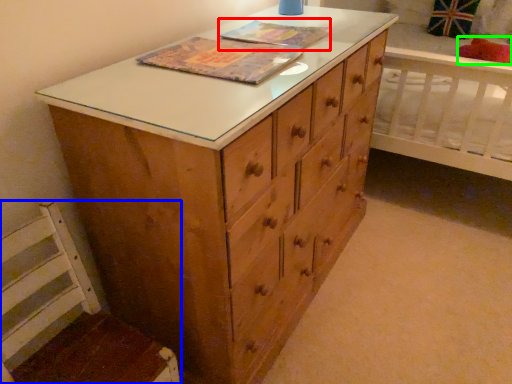
Question: Which is farther away from book cover (highlighted by a red box)? swivel chair (highlighted by a blue box) or pillow (highlighted by a green box)?

Choices:
 (A) swivel chair
 (B) pillow

Answer: (B)